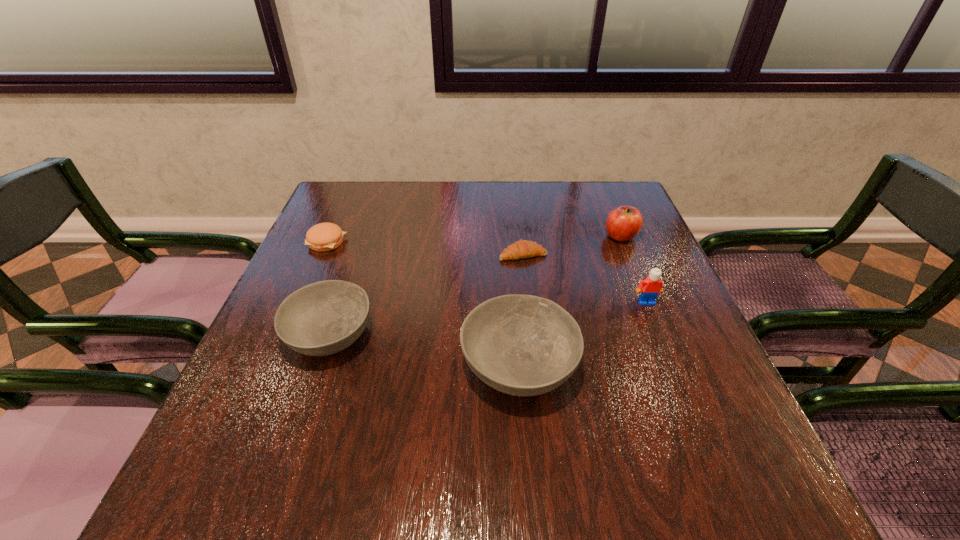
Image resolution: width=960 pixels, height=540 pixels. I want to click on vacant space at the left edge of the desktop, so click(257, 357).

Locate an element on the screen. The image size is (960, 540). free location at the right edge of the desktop is located at coordinates (711, 393).

Identify the location of vacant space at the far left corner of the desktop. Image resolution: width=960 pixels, height=540 pixels. 351,207.

In the image, there is a desktop. Where is `vacant area at the far right corner`? vacant area at the far right corner is located at coordinates (613, 208).

The image size is (960, 540). Find the location of `free point between the apple and the right bowl`. free point between the apple and the right bowl is located at coordinates (569, 301).

Where is `empty space between the Lego and the apple`? This screenshot has height=540, width=960. empty space between the Lego and the apple is located at coordinates (634, 269).

You are a GUI agent. You are given a task and a screenshot of the screen. Output one action in this format:
    pyautogui.click(x=<x>, y=<y>)
    Task: Click on the free area in between the right bowl and the second shortest object
    Image resolution: width=960 pixels, height=540 pixels.
    Given the screenshot: What is the action you would take?
    pyautogui.click(x=422, y=304)

The width and height of the screenshot is (960, 540). I want to click on empty location between the apple and the taller bowl, so click(x=569, y=301).

Identify the location of free space between the apple and the Lego. (634, 269).

This screenshot has height=540, width=960. I want to click on free space between the Lego and the patty, so tap(487, 272).